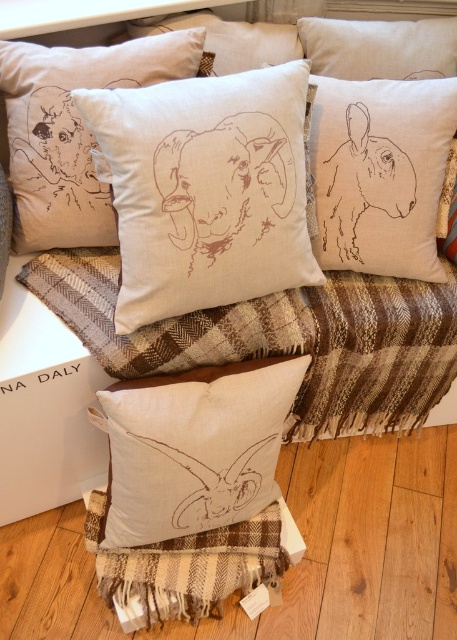
You are arranging decorative items on a shelf and need to place the matte beige cushion at center. If the shelf is divided into a grid with coordinates from 0 to 1 on both axes, where would you position it?

The matte beige cushion at center should be placed at the coordinates point (194, 448) on the shelf grid.